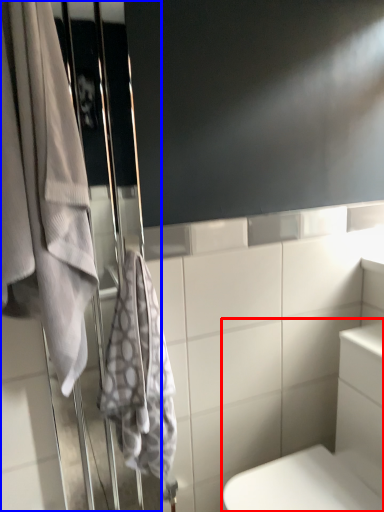
Question: Which point is closer to the camera, bath (highlighted by a red box) or screen door (highlighted by a blue box)?

Choices:
 (A) bath
 (B) screen door

Answer: (A)